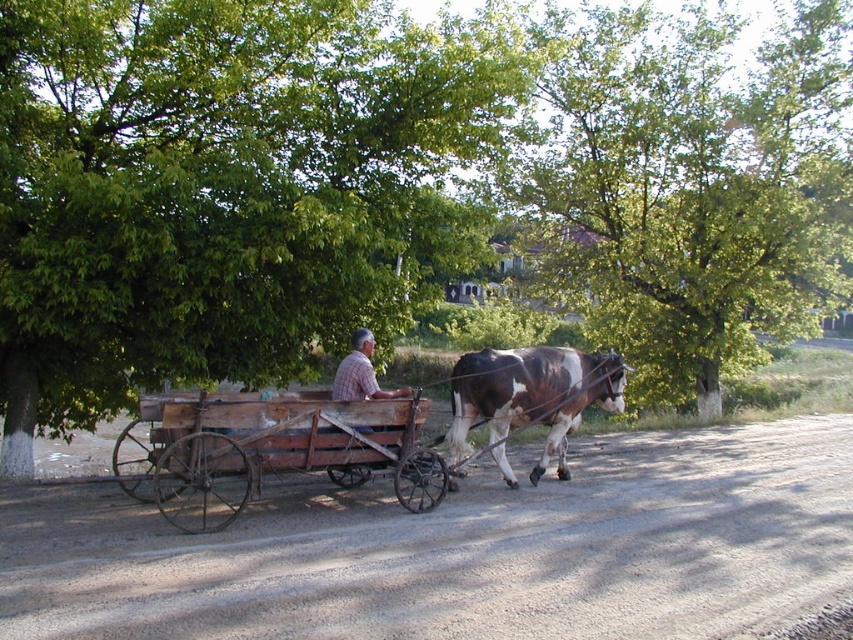
Question: Does green leafy tree at upper left appear on the left side of brown and white fur at center?

Choices:
 (A) no
 (B) yes

Answer: (B)

Question: Is green leafy tree at center to the left of plaid fabric shirt at center from the viewer's perspective?

Choices:
 (A) no
 (B) yes

Answer: (A)

Question: Is green leafy tree at center closer to camera compared to brown and white fur at center?

Choices:
 (A) no
 (B) yes

Answer: (A)

Question: Which of the following is the closest to the observer?

Choices:
 (A) green leafy tree at center
 (B) green leafy tree at upper left

Answer: (B)

Question: Which point appears farthest from the camera in this image?

Choices:
 (A) (252, 451)
 (B) (556, 147)
 (C) (526, 384)
 (D) (436, 161)

Answer: (B)

Question: Which object is positioned farthest from the plaid fabric shirt at center?

Choices:
 (A) green leafy tree at upper left
 (B) green leafy tree at center

Answer: (B)